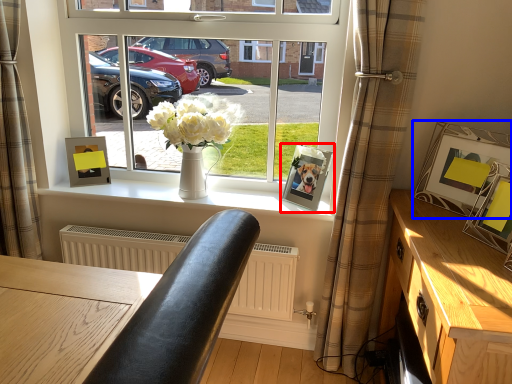
Question: Which object appears farthest to the camera in this image, picture frame (highlighted by a red box) or picture frame (highlighted by a blue box)?

Choices:
 (A) picture frame
 (B) picture frame

Answer: (A)